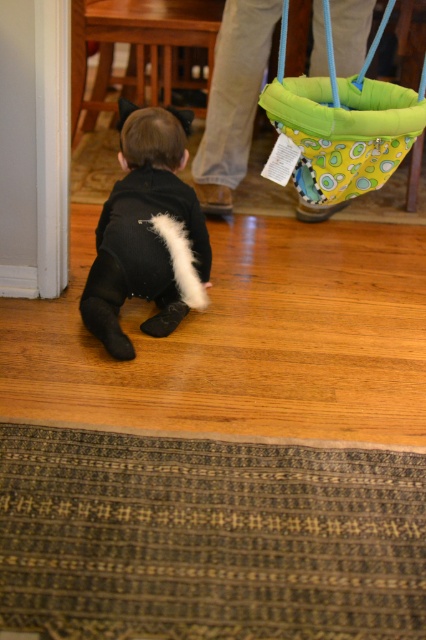
You are a parent trying to place a toy for your child to reach while they are on the polished wooden floor. The black soft plush at center is currently in the way. Can you move it to the green fabric hammock at upper right without it being too far for the child to reach?

The distance between the black soft plush at center and the green fabric hammock at upper right is 22.12 inches. Since the child is crawling on the polished wooden floor, moving the plush to the hammock at that distance should be manageable for the child to reach, assuming their crawling ability covers that span.